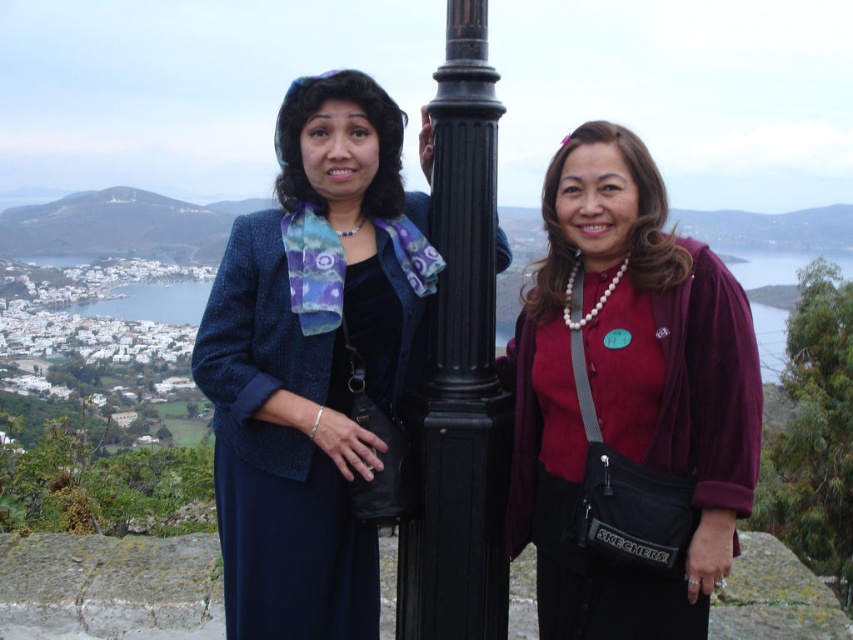
Question: Which object appears closest to the camera in this image?

Choices:
 (A) velvet maroon blouse at center
 (B) velvet blue dress at center

Answer: (A)

Question: Does velvet blue dress at center lie in front of black metal pole at center?

Choices:
 (A) no
 (B) yes

Answer: (A)

Question: Which point is farther from the camera taking this photo?

Choices:
 (A) (376, 451)
 (B) (619, 468)
 (C) (488, 339)

Answer: (A)

Question: Can you confirm if velvet blue dress at center is positioned below black metal pole at center?

Choices:
 (A) yes
 (B) no

Answer: (A)

Question: Which point is closer to the camera taking this photo?

Choices:
 (A) (492, 598)
 (B) (752, 488)
 (C) (294, 333)

Answer: (A)

Question: Does velvet maroon blouse at center appear under velvet blue dress at center?

Choices:
 (A) yes
 (B) no

Answer: (A)